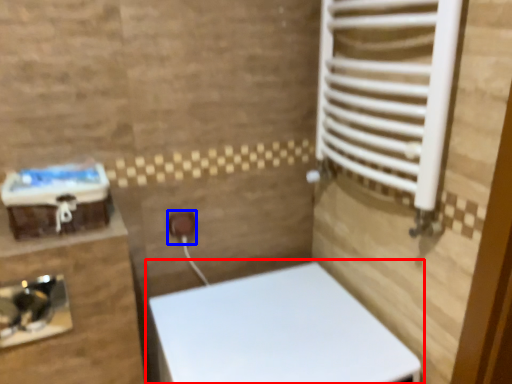
Question: Among these objects, which one is farthest to the camera, toilet (highlighted by a red box) or electric outlet (highlighted by a blue box)?

Choices:
 (A) toilet
 (B) electric outlet

Answer: (B)